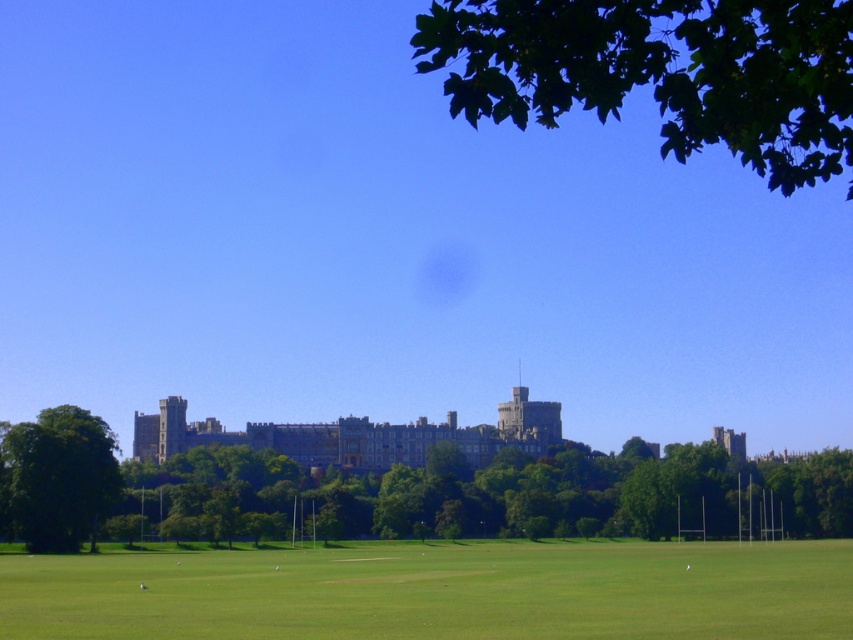
Question: Considering the relative positions of green grassy field at lower center and green leafy tree at left in the image provided, where is green grassy field at lower center located with respect to green leafy tree at left?

Choices:
 (A) right
 (B) left

Answer: (A)

Question: Which object is positioned closest to the green leafy tree at left?

Choices:
 (A) green leafy tree at center
 (B) gray stone castle at center

Answer: (A)

Question: Is green leafy tree at upper right closer to camera compared to gray stone castle at center?

Choices:
 (A) no
 (B) yes

Answer: (B)

Question: Which is farther from the green leafy tree at upper right?

Choices:
 (A) gray stone castle at center
 (B) green leafy tree at center
 (C) green grassy field at lower center
 (D) green leafy tree at left

Answer: (A)

Question: Which object is closer to the camera taking this photo?

Choices:
 (A) green leafy tree at left
 (B) green grassy field at lower center
 (C) green leafy tree at center

Answer: (B)

Question: Is green leafy tree at upper right above green leafy tree at left?

Choices:
 (A) yes
 (B) no

Answer: (A)